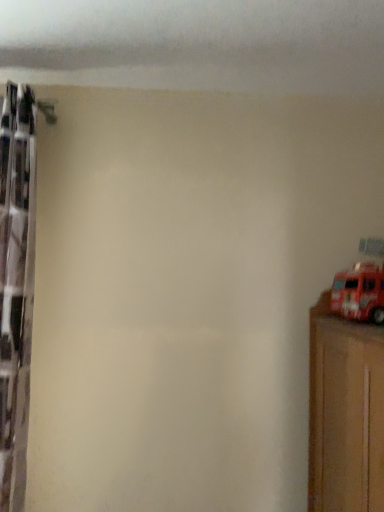
Where is `shiny red toy truck at right`? The height and width of the screenshot is (512, 384). shiny red toy truck at right is located at coordinates (359, 293).

What do you see at coordinates (359, 293) in the screenshot? This screenshot has height=512, width=384. I see `shiny red toy truck at right` at bounding box center [359, 293].

This screenshot has width=384, height=512. I want to click on shiny red toy truck at right, so click(x=359, y=293).